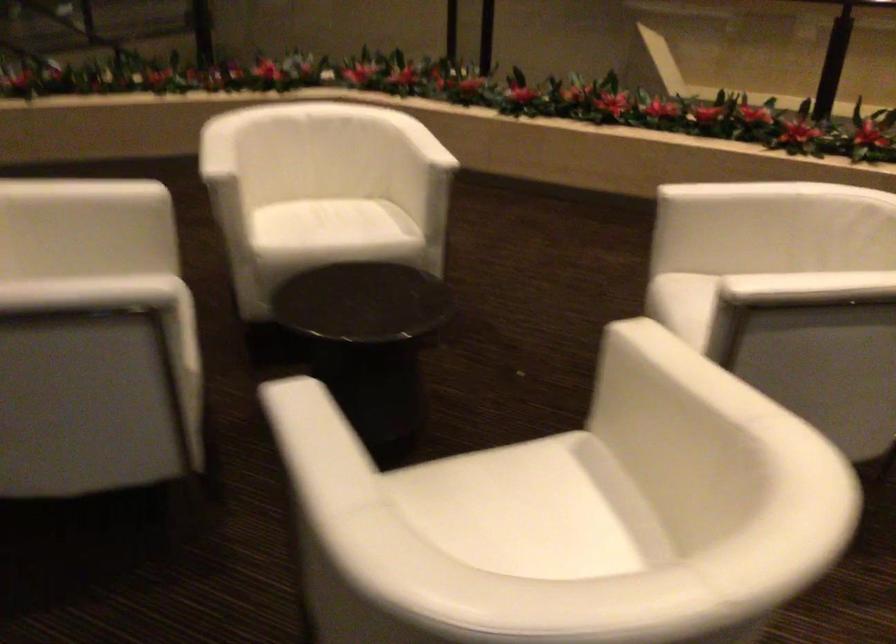
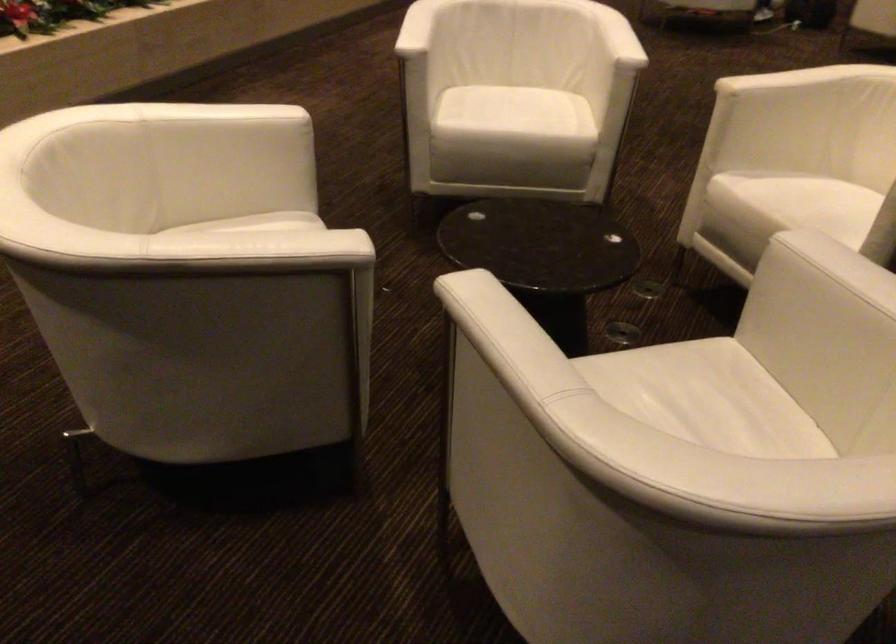
The point at (126,345) is marked in the first image. Where is the corresponding point in the second image?

(686, 388)